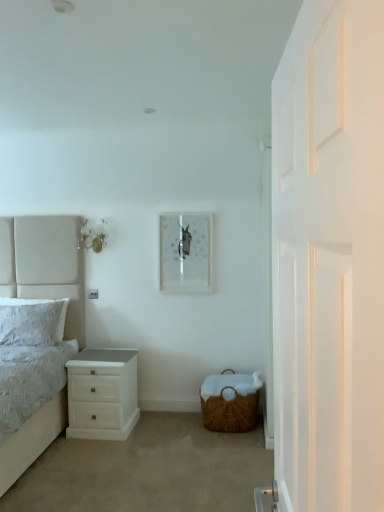
Describe the element at coordinates (32, 321) in the screenshot. The image size is (384, 512). I see `white textured pillow at left` at that location.

The image size is (384, 512). Identify the location of white textured pillow at left. (32, 321).

What do you see at coordinates (45, 264) in the screenshot? I see `white fabric bed at left` at bounding box center [45, 264].

Where is `matte white picture frame at center`? This screenshot has height=512, width=384. matte white picture frame at center is located at coordinates (185, 253).

The width and height of the screenshot is (384, 512). I want to click on white glossy chest of drawers at lower left, so 102,394.

Can you confirm if woven brown basket at lower right is wider than matte white picture frame at center?

Indeed, woven brown basket at lower right has a greater width compared to matte white picture frame at center.

Is woven brown basket at lower right to the right of matte white picture frame at center from the viewer's perspective?

Yes, woven brown basket at lower right is to the right of matte white picture frame at center.

From the image's perspective, is woven brown basket at lower right beneath matte white picture frame at center?

Yes, from the image's perspective, woven brown basket at lower right is below matte white picture frame at center.

I want to click on picture frame behind the woven brown basket at lower right, so click(x=185, y=253).

Does white glossy chest of drawers at lower left have a greater width compared to white textured pillow at left?

Indeed, white glossy chest of drawers at lower left has a greater width compared to white textured pillow at left.

Is white textured pillow at left at the back of white glossy chest of drawers at lower left?

No, white glossy chest of drawers at lower left's orientation is not away from white textured pillow at left.

Which is closer to the camera, (86, 387) or (62, 308)?

The point (86, 387) is closer to the camera.

Can you confirm if white glossy chest of drawers at lower left is shorter than white textured pillow at left?

No, white glossy chest of drawers at lower left is not shorter than white textured pillow at left.

From a real-world perspective, which is physically above, white wooden door at right or woven brown basket at lower right?

white wooden door at right, from a real-world perspective.

Is point (292, 162) positioned after point (224, 394)?

No.

Who is taller, white wooden door at right or woven brown basket at lower right?

With more height is white wooden door at right.

Considering the sizes of objects white wooden door at right and woven brown basket at lower right in the image provided, who is smaller, white wooden door at right or woven brown basket at lower right?

woven brown basket at lower right.

Does point (293, 36) lie behind point (102, 364)?

No, (293, 36) is closer to viewer.

Is white glossy chest of drawers at lower left completely or partially inside white wooden door at right?

No, white glossy chest of drawers at lower left is located outside of white wooden door at right.

Is white wooden door at right with white glossy chest of drawers at lower left?

No.

Considering their positions, is white wooden door at right located in front of or behind white glossy chest of drawers at lower left?

Visually, white wooden door at right is located in front of white glossy chest of drawers at lower left.

Considering the relative positions of white glossy chest of drawers at lower left and white wooden door at right in the image provided, is white glossy chest of drawers at lower left to the left or to the right of white wooden door at right?

white glossy chest of drawers at lower left is to the left of white wooden door at right.

Is point (72, 430) less distant than point (320, 468)?

No.

Where is `the chest of drawers located below the white wooden door at right (from the image's perspective)`? The width and height of the screenshot is (384, 512). the chest of drawers located below the white wooden door at right (from the image's perspective) is located at coordinates (102, 394).

Is point (75, 242) closer or farther from the camera than point (3, 301)?

Point (75, 242) appears to be farther away from the viewer than point (3, 301).

Does white fabric bed at left have a lesser width compared to white textured pillow at left?

In fact, white fabric bed at left might be wider than white textured pillow at left.

Are white fabric bed at left and white textured pillow at left located far from each other?

Actually, white fabric bed at left and white textured pillow at left are a little close together.

Which is correct: white fabric bed at left is inside white textured pillow at left, or outside of it?

The correct answer is: outside.

Consider the image. Are white textured pillow at left and white glossy chest of drawers at lower left far apart?

No, white textured pillow at left is not far from white glossy chest of drawers at lower left.

Does point (33, 325) come in front of point (79, 421)?

No, it is behind (79, 421).

Is white textured pillow at left located outside white glossy chest of drawers at lower left?

Absolutely, white textured pillow at left is external to white glossy chest of drawers at lower left.

Is white textured pillow at left wider or thinner than white glossy chest of drawers at lower left?

Considering their sizes, white textured pillow at left looks slimmer than white glossy chest of drawers at lower left.

Find the location of a particular element. Image resolution: width=384 pixels, height=512 pixels. basket on the right of matte white picture frame at center is located at coordinates (230, 402).

In the image, there is a white textured pillow at left. Where is `the chest of drawers below it (from a real-world perspective)`? Image resolution: width=384 pixels, height=512 pixels. the chest of drawers below it (from a real-world perspective) is located at coordinates (102, 394).

Considering their positions, is white textured pillow at left positioned further to woven brown basket at lower right than white fabric bed at left?

white fabric bed at left is further to woven brown basket at lower right.

From the picture: Based on their spatial positions, is white wooden door at right or white fabric bed at left closer to white textured pillow at left?

white fabric bed at left is closer to white textured pillow at left.

Which object lies further to the anchor point white wooden door at right, white fabric bed at left or white glossy chest of drawers at lower left?

Based on the image, white fabric bed at left appears to be further to white wooden door at right.

Based on their spatial positions, is woven brown basket at lower right or white textured pillow at left further from matte white picture frame at center?

white textured pillow at left is positioned further to the anchor matte white picture frame at center.

From the image, which object appears to be nearer to white fabric bed at left, matte white picture frame at center or white glossy chest of drawers at lower left?

Based on the image, white glossy chest of drawers at lower left appears to be nearer to white fabric bed at left.

Considering their positions, is white textured pillow at left positioned further to white wooden door at right than white fabric bed at left?

Among the two, white fabric bed at left is located further to white wooden door at right.

Estimate the real-world distances between objects in this image. Which object is closer to woven brown basket at lower right, white wooden door at right or white fabric bed at left?

Among the two, white fabric bed at left is located nearer to woven brown basket at lower right.

When comparing their distances from white textured pillow at left, does matte white picture frame at center or white fabric bed at left seem further?

matte white picture frame at center.

You are a GUI agent. You are given a task and a screenshot of the screen. Output one action in this format:
    pyautogui.click(x=<x>, y=<y>)
    Task: Click on the chest of drawers between white textured pillow at left and matte white picture frame at center in the horizontal direction
    The height and width of the screenshot is (512, 384).
    Given the screenshot: What is the action you would take?
    pyautogui.click(x=102, y=394)

Locate an element on the screen. The image size is (384, 512). basket between white wooden door at right and matte white picture frame at center from front to back is located at coordinates (230, 402).

Find the location of a particular element. This screenshot has width=384, height=512. the chest of drawers located between white fabric bed at left and woven brown basket at lower right in the left-right direction is located at coordinates (102, 394).

Find the location of a particular element. This screenshot has height=512, width=384. chest of drawers between white wooden door at right and woven brown basket at lower right along the z-axis is located at coordinates (102, 394).